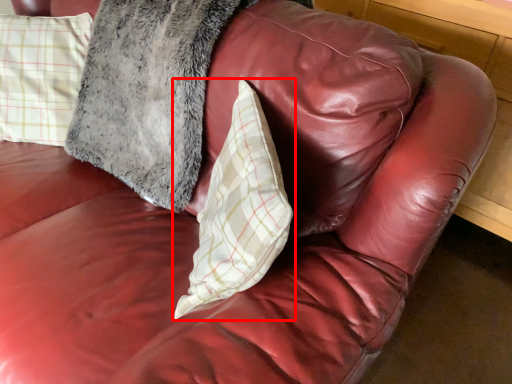
Question: From the image's perspective, what is the correct spatial relationship of pillow (annotated by the red box) in relation to pillow?

Choices:
 (A) above
 (B) below

Answer: (B)